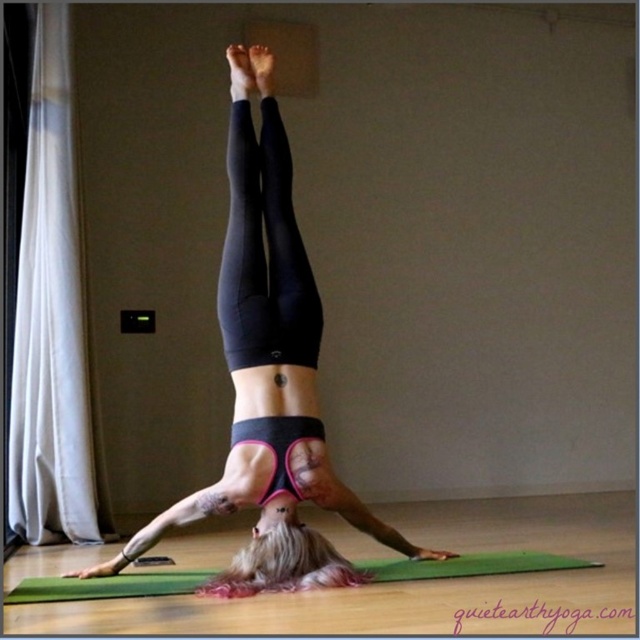
Question: Which of the following is the closest to the observer?

Choices:
 (A) black matte leggings at center
 (B) green rubber yoga mat at center

Answer: (A)

Question: Can you confirm if black matte leggings at center is positioned to the right of green rubber yoga mat at center?

Choices:
 (A) yes
 (B) no

Answer: (B)

Question: Which object is closer to the camera taking this photo?

Choices:
 (A) green rubber yoga mat at center
 (B) black matte leggings at center

Answer: (B)

Question: Which object is closer to the camera taking this photo?

Choices:
 (A) green rubber yoga mat at center
 (B) black matte leggings at center

Answer: (B)

Question: Is black matte leggings at center positioned in front of green rubber yoga mat at center?

Choices:
 (A) no
 (B) yes

Answer: (B)

Question: Is the position of black matte leggings at center more distant than that of green rubber yoga mat at center?

Choices:
 (A) yes
 (B) no

Answer: (B)